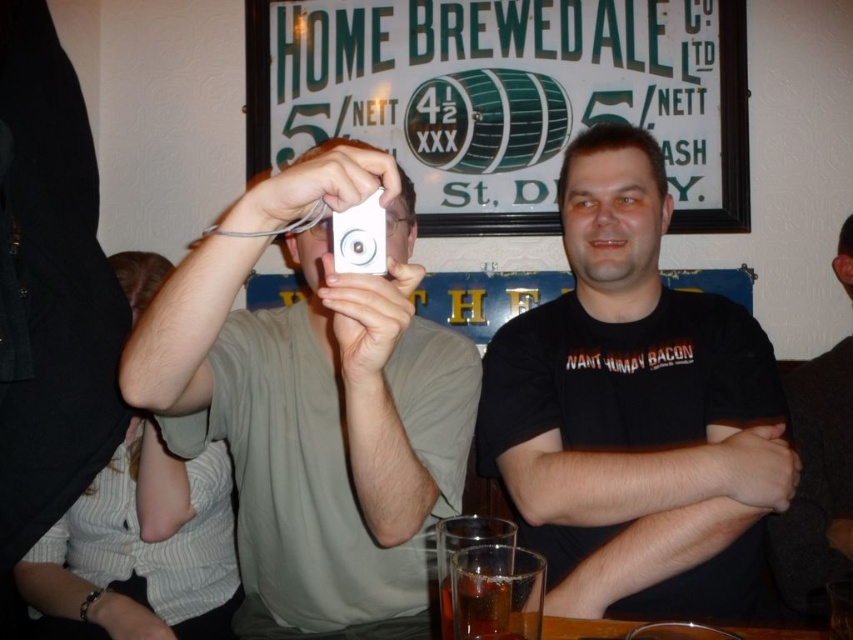
Question: From the image, what is the correct spatial relationship of white matte camera at center in relation to black matte shirt at center?

Choices:
 (A) left
 (B) right

Answer: (A)

Question: Is white matte camera at center smaller than black matte shirt at center?

Choices:
 (A) no
 (B) yes

Answer: (A)

Question: Which of the following is the farthest from the observer?

Choices:
 (A) white plastic game controller at upper center
 (B) white matte camera at center
 (C) black matte shirt at center

Answer: (C)

Question: Which is farther from the black matte shirt at center?

Choices:
 (A) white plastic game controller at upper center
 (B) white matte camera at center

Answer: (A)

Question: Can you confirm if white matte camera at center is thinner than black matte shirt at center?

Choices:
 (A) no
 (B) yes

Answer: (B)

Question: Among these points, which one is nearest to the camera?

Choices:
 (A) (561, 502)
 (B) (345, 214)

Answer: (B)